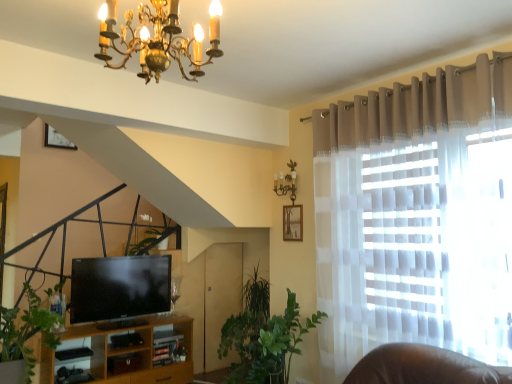
Question: Considering the positions of point (275, 337) and point (414, 160), is point (275, 337) closer or farther from the camera than point (414, 160)?

Choices:
 (A) farther
 (B) closer

Answer: (A)

Question: Is green leafy plant at center wider or thinner than matte beige curtain at upper right?

Choices:
 (A) thin
 (B) wide

Answer: (A)

Question: Is green leafy plant at center situated inside matte beige curtain at upper right or outside?

Choices:
 (A) outside
 (B) inside

Answer: (A)

Question: Considering the positions of matte beige curtain at upper right and green leafy plant at center in the image, is matte beige curtain at upper right wider or thinner than green leafy plant at center?

Choices:
 (A) thin
 (B) wide

Answer: (B)

Question: In terms of height, does matte beige curtain at upper right look taller or shorter compared to green leafy plant at center?

Choices:
 (A) tall
 (B) short

Answer: (A)

Question: From the image's perspective, is matte beige curtain at upper right located above or below green leafy plant at center?

Choices:
 (A) above
 (B) below

Answer: (A)

Question: In the image, is matte beige curtain at upper right on the left side or the right side of green leafy plant at center?

Choices:
 (A) left
 (B) right

Answer: (B)